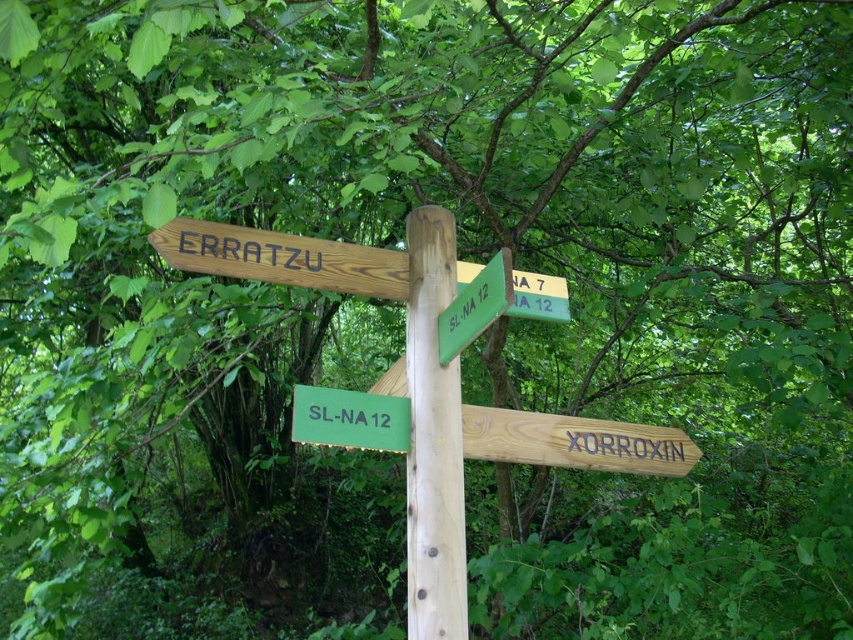
Question: Is the position of wooden signpost at center more distant than that of wooden signpost at upper center?

Choices:
 (A) no
 (B) yes

Answer: (B)

Question: Can you confirm if wooden signpost at center is bigger than wooden signpost at upper center?

Choices:
 (A) yes
 (B) no

Answer: (B)

Question: Which of the following is the closest to the observer?

Choices:
 (A) wooden signpost at upper center
 (B) wooden signpost at center

Answer: (A)

Question: Is wooden signpost at center bigger than wooden signpost at upper center?

Choices:
 (A) no
 (B) yes

Answer: (A)